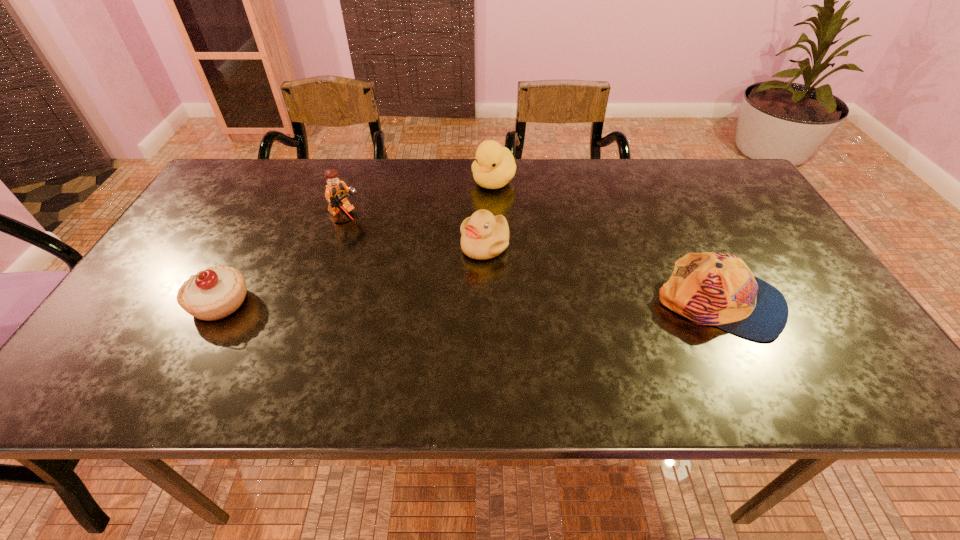
Find the location of `free space between the farthest object and the rightmost object`. free space between the farthest object and the rightmost object is located at coordinates (607, 243).

At what (x,y) coordinates should I click in order to perform the action: click on free space between the pastry and the fourth object from right to left. Please return your answer as a coordinate pair (x, y). Looking at the image, I should click on (283, 260).

Identify the location of free spot between the Lego and the leftmost object. This screenshot has width=960, height=540. (283, 260).

The height and width of the screenshot is (540, 960). Identify the location of unoccupied position between the farthest object and the cap. (607, 243).

Find the location of `empty space that is in between the Lego and the duckling`. empty space that is in between the Lego and the duckling is located at coordinates (416, 232).

Locate an element on the screen. The height and width of the screenshot is (540, 960). free space between the duckling and the pastry is located at coordinates (352, 274).

The image size is (960, 540). What are the coordinates of `empty location between the duckling and the second object from left to right` in the screenshot? It's located at (416, 232).

Locate an element on the screen. The width and height of the screenshot is (960, 540). vacant area that lies between the farthest object and the leftmost object is located at coordinates (356, 242).

Point out which object is positioned as the fourth nearest to the fourth object from right to left. Please provide its 2D coordinates. Your answer should be formatted as a tuple, i.e. [(x, y)], where the tuple contains the x and y coordinates of a point satisfying the conditions above.

[(710, 288)]

Image resolution: width=960 pixels, height=540 pixels. Find the location of `object that is the second closest to the duckling`. object that is the second closest to the duckling is located at coordinates (336, 191).